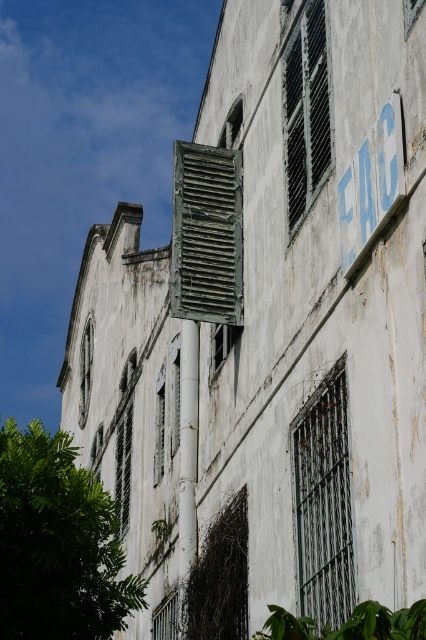
Question: Considering the relative positions of weathered wood shutter at upper center and blue painted sign at upper right in the image provided, where is weathered wood shutter at upper center located with respect to blue painted sign at upper right?

Choices:
 (A) right
 (B) left

Answer: (B)

Question: Among these objects, which one is farthest from the camera?

Choices:
 (A) blue painted sign at upper right
 (B) green leafy tree at lower left

Answer: (B)

Question: Which of the following is the farthest from the observer?

Choices:
 (A) blue painted sign at upper right
 (B) green leafy tree at lower left
 (C) rusty metal shutter at center

Answer: (B)

Question: Can you confirm if green leafy tree at lower left is smaller than weathered wood shutter at upper center?

Choices:
 (A) yes
 (B) no

Answer: (B)

Question: Which point appears closest to the camera in this image?

Choices:
 (A) (310, 38)
 (B) (48, 509)

Answer: (B)

Question: Is green leafy tree at lower left in front of weathered wood shutter at upper center?

Choices:
 (A) yes
 (B) no

Answer: (A)